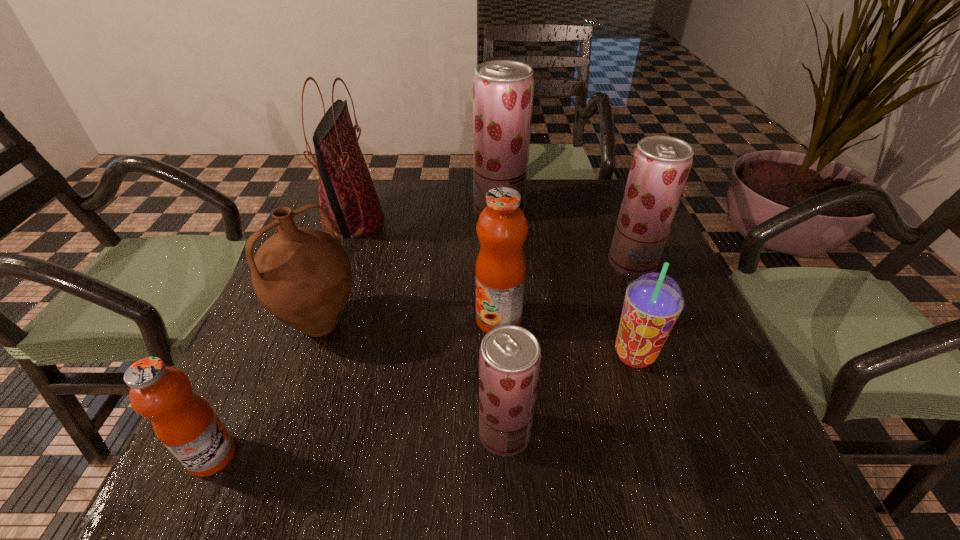
The width and height of the screenshot is (960, 540). What are the coordinates of `the farthest fruit juice` in the screenshot? It's located at (503, 90).

Where is `the biggest strawberry fruit juice`? The width and height of the screenshot is (960, 540). the biggest strawberry fruit juice is located at coordinates (503, 90).

At what (x,y) coordinates should I click in order to perform the action: click on handbag. Please return your answer as a coordinate pair (x, y). The width and height of the screenshot is (960, 540). Looking at the image, I should click on (346, 191).

The width and height of the screenshot is (960, 540). In order to click on the rightmost fruit juice in this screenshot , I will do tap(661, 164).

Locate an element on the screen. The width and height of the screenshot is (960, 540). the second farthest strawberry fruit juice is located at coordinates point(661,164).

Where is `the farther orange fruit juice`? Image resolution: width=960 pixels, height=540 pixels. the farther orange fruit juice is located at coordinates (502, 228).

Locate an element on the screen. The width and height of the screenshot is (960, 540). the right orange fruit juice is located at coordinates [x=502, y=228].

The height and width of the screenshot is (540, 960). I want to click on brown pitcher, so click(302, 276).

You are a GUI agent. You are given a task and a screenshot of the screen. Output one action in this format:
    pyautogui.click(x=<x>, y=<y>)
    Task: Click on the smoothie
    This screenshot has width=960, height=540.
    Given the screenshot: What is the action you would take?
    pyautogui.click(x=653, y=302)

Locate an element on the screen. the nearest strawberry fruit juice is located at coordinates (509, 356).